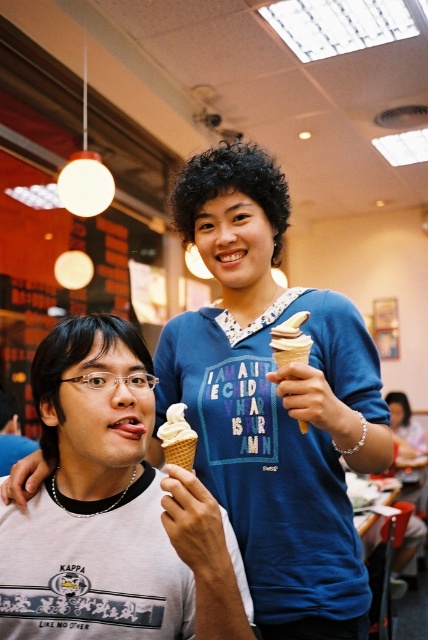
You are a customer at this ice cream shop and want to choose between the white matte ice cream cone at center and the white waffle cone at center. Which one is larger in size?

The white matte ice cream cone at center is bigger than the white waffle cone at center, so the white matte ice cream cone at center is larger in size.

You are a photographer standing at the entrance of the ice cream shop. You want to take a closeup shot of the white waffle cone ice cream at center. What is the minimum distance you need to move forward to get the shot?

The white waffle cone ice cream at center is currently 3.41 feet away from the camera. To take a closeup shot, you would need to move forward until the distance is reduced to the desired framing. However, without specific focal length or desired magnification details, the exact distance cannot be calculated. But the initial distance to start from is 3.41 feet.

You are a customer in the shop and want to choose the bigger ice cream. Which one should you pick between the white waffle cone ice cream at center and the white matte ice cream cone at center?

The white waffle cone ice cream at center is larger in size than the white matte ice cream cone at center, so you should pick the white waffle cone ice cream at center.